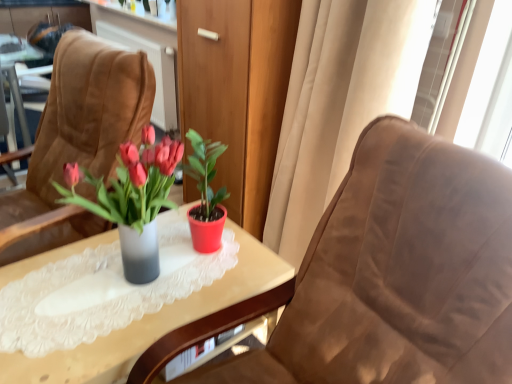
Question: Based on their positions, is matte plastic vase at center located to the left or right of suede chair at left, placed as the first chair when sorted from left to right?

Choices:
 (A) left
 (B) right

Answer: (B)

Question: Considering the positions of matte plastic vase at center and suede chair at left, the second chair in the right-to-left sequence, in the image, is matte plastic vase at center wider or thinner than suede chair at left, the second chair in the right-to-left sequence,?

Choices:
 (A) wide
 (B) thin

Answer: (B)

Question: Which of these objects is positioned farthest from the matte plastic vase at center?

Choices:
 (A) translucent glass vase at center
 (B) suede chair at center, the first chair when ordered from right to left
 (C) suede chair at left, the second chair in the right-to-left sequence
 (D) beige fabric curtain at right

Answer: (D)

Question: Estimate the real-world distances between objects in this image. Which object is farther from the beige fabric curtain at right?

Choices:
 (A) translucent glass vase at center
 (B) matte plastic vase at center
 (C) suede chair at center, the first chair when ordered from right to left
 (D) suede chair at left, placed as the first chair when sorted from left to right

Answer: (D)